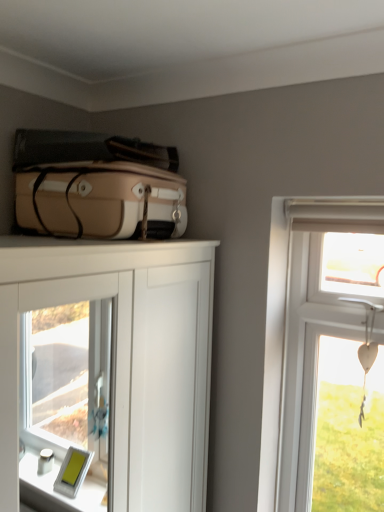
Question: Is point (296, 263) positioned closer to the camera than point (140, 446)?

Choices:
 (A) farther
 (B) closer

Answer: (A)

Question: Is white wooden heart at upper right in front of or behind white glossy cabinet at center in the image?

Choices:
 (A) front
 (B) behind

Answer: (B)

Question: Which object is the closest to the white glossy cabinet at center?

Choices:
 (A) matte beige suitcase at upper left
 (B) white wooden heart at upper right

Answer: (A)

Question: Which of these objects is positioned closest to the matte beige suitcase at upper left?

Choices:
 (A) white wooden heart at upper right
 (B) white glossy cabinet at center

Answer: (A)